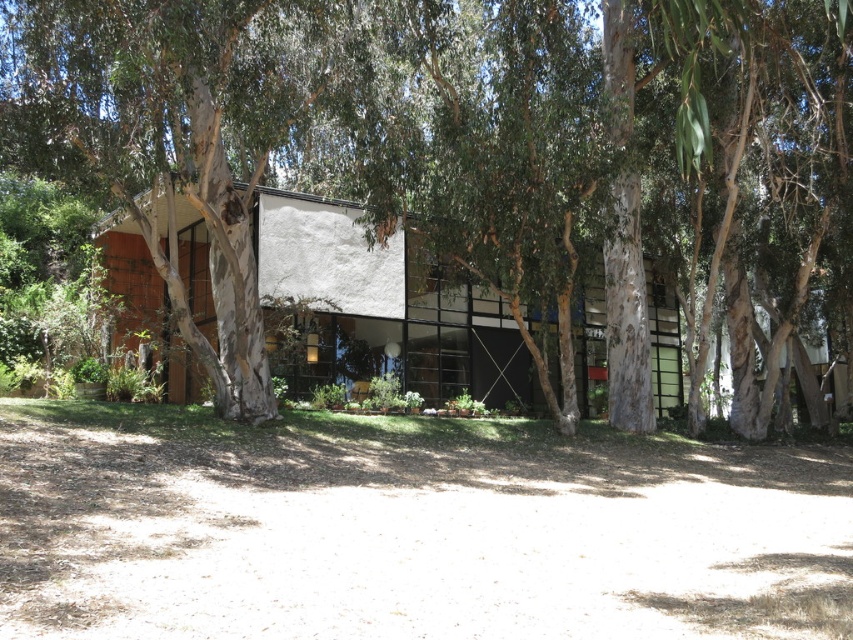
Question: Which point is closer to the camera?

Choices:
 (A) (387, 289)
 (B) (9, 88)

Answer: (B)

Question: In this image, where is white textured tree at center located relative to white stucco house at center?

Choices:
 (A) left
 (B) right

Answer: (B)

Question: Can you confirm if white textured tree at center is wider than white stucco house at center?

Choices:
 (A) no
 (B) yes

Answer: (A)

Question: Does white textured tree at center have a smaller size compared to white stucco house at center?

Choices:
 (A) no
 (B) yes

Answer: (A)

Question: Among these points, which one is farthest from the camera?

Choices:
 (A) (167, 160)
 (B) (132, 272)

Answer: (B)

Question: Which point is closer to the camera taking this photo?

Choices:
 (A) (181, 198)
 (B) (196, 29)

Answer: (B)